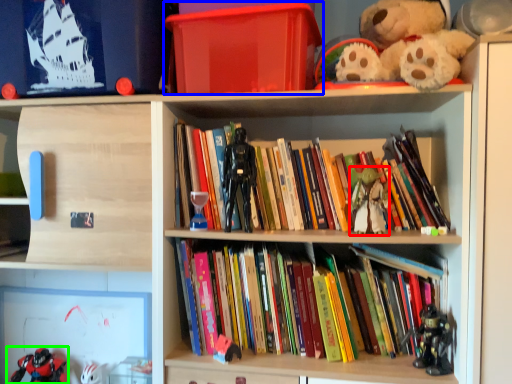
Question: Considering the real-world distances, which object is farthest from toy (highlighted by a red box)? box (highlighted by a blue box) or toy (highlighted by a green box)?

Choices:
 (A) box
 (B) toy

Answer: (B)